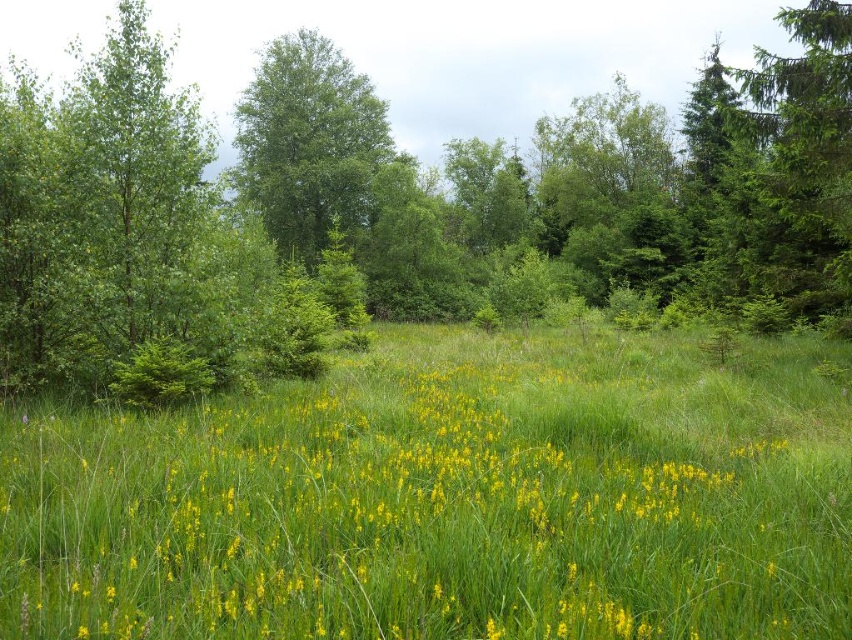
Consider the image. You are standing in the lush natural landscape and want to walk from the point closer to you to the farther point. Which path would you take between the two points, point (406, 557) and point (331, 150)?

You should take the path from point (406, 557) to point (331, 150) since point (406, 557) is closer to the viewer and you want to move towards the farther point.